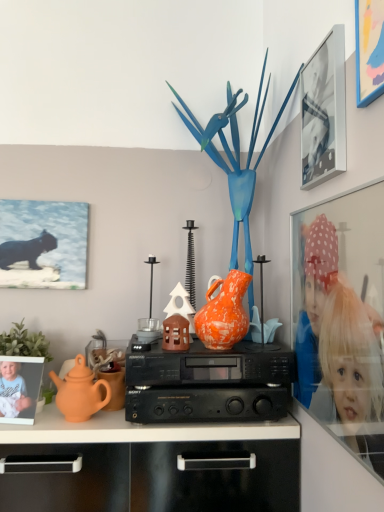
This screenshot has width=384, height=512. Describe the element at coordinates (324, 111) in the screenshot. I see `metallic silver picture frame at upper right, which is counted as the second picture frame, starting from the back` at that location.

What do you see at coordinates (235, 156) in the screenshot? I see `blue glossy bird at center` at bounding box center [235, 156].

How much space does matte black cat at upper left, which ranks as the 4th picture frame in right-to-left order, occupy vertically?

The height of matte black cat at upper left, which ranks as the 4th picture frame in right-to-left order, is 12.28 inches.

Find the location of a particular element. The width and height of the screenshot is (384, 512). green matte plant at left is located at coordinates (24, 343).

Measure the distance between point [239,315] and camera.

The depth of point [239,315] is 3.76 feet.

Where is `black plastic stereo at center`? black plastic stereo at center is located at coordinates (208, 383).

Is metallic silver picture frame at upper right, which is counted as the third picture frame, starting from the right, oriented away from black plastic stereo at center?

No, metallic silver picture frame at upper right, which is counted as the third picture frame, starting from the right,'s orientation is not away from black plastic stereo at center.

Is metallic silver picture frame at upper right, marked as the second picture frame in a left-to-right arrangement, directly adjacent to black plastic stereo at center?

There is a gap between metallic silver picture frame at upper right, marked as the second picture frame in a left-to-right arrangement, and black plastic stereo at center.

Based on the photo, does metallic silver picture frame at upper right, which is counted as the second picture frame, starting from the back, have a lesser height compared to black plastic stereo at center?

No, metallic silver picture frame at upper right, which is counted as the second picture frame, starting from the back, is not shorter than black plastic stereo at center.

From the image's perspective, which one is positioned lower, black plastic stereo at center or orange speckled vase at center?

black plastic stereo at center appears lower in the image.

Would you say black plastic stereo at center is inside or outside orange speckled vase at center?

black plastic stereo at center cannot be found inside orange speckled vase at center.

Is black plastic stereo at center to the left or to the right of orange speckled vase at center in the image?

Clearly, black plastic stereo at center is on the left of orange speckled vase at center in the image.

Does black plastic stereo at center have a greater width compared to orange speckled vase at center?

Correct, the width of black plastic stereo at center exceeds that of orange speckled vase at center.

Who is more distant, orange speckled vase at center or blue matte picture frame at upper right, the 4th picture frame from the back?

orange speckled vase at center.

Is orange speckled vase at center not close to blue matte picture frame at upper right, the 1th picture frame positioned from the right?

No.

In the image, is orange speckled vase at center on the left side or the right side of blue matte picture frame at upper right, which is the 1th picture frame in front-to-back order?

Based on their positions, orange speckled vase at center is located to the left of blue matte picture frame at upper right, which is the 1th picture frame in front-to-back order.

Find the location of a particular element. vase behind the blue matte picture frame at upper right, the 4th picture frame in the left-to-right sequence is located at coordinates (224, 313).

Is glass photo frame at right, which ranks as the 2th picture frame in front-to-back order, not within metallic silver picture frame at upper right, which ranks as the third picture frame in front-to-back order?

Yes.

From the image's perspective, is glass photo frame at right, which is the 3th picture frame from left to right, above or below metallic silver picture frame at upper right, which is counted as the third picture frame, starting from the right?

Based on their image positions, glass photo frame at right, which is the 3th picture frame from left to right, is located beneath metallic silver picture frame at upper right, which is counted as the third picture frame, starting from the right.

Is glass photo frame at right, marked as the 3th picture frame in a back-to-front arrangement, aimed at metallic silver picture frame at upper right, which is counted as the second picture frame, starting from the back?

No, glass photo frame at right, marked as the 3th picture frame in a back-to-front arrangement, is not aimed at metallic silver picture frame at upper right, which is counted as the second picture frame, starting from the back.

Would you say glass photo frame at right, marked as the 3th picture frame in a back-to-front arrangement, is a long distance from metallic silver picture frame at upper right, which ranks as the third picture frame in front-to-back order?

glass photo frame at right, marked as the 3th picture frame in a back-to-front arrangement, is actually quite close to metallic silver picture frame at upper right, which ranks as the third picture frame in front-to-back order.

From the picture: From a real-world perspective, is glass photo frame at right, which ranks as the 2th picture frame in front-to-back order, below blue glossy bird at center?

Yes, from a real-world perspective, glass photo frame at right, which ranks as the 2th picture frame in front-to-back order, is below blue glossy bird at center.

In the scene shown: Does glass photo frame at right, marked as the 3th picture frame in a back-to-front arrangement, have a lesser height compared to blue glossy bird at center?

Indeed, glass photo frame at right, marked as the 3th picture frame in a back-to-front arrangement, has a lesser height compared to blue glossy bird at center.

Would you say glass photo frame at right, which is the 3th picture frame from left to right, is outside blue glossy bird at center?

That's correct, glass photo frame at right, which is the 3th picture frame from left to right, is outside of blue glossy bird at center.

Considering the positions of objects glass photo frame at right, which ranks as the 2th picture frame in front-to-back order, and blue glossy bird at center in the image provided, who is more to the right, glass photo frame at right, which ranks as the 2th picture frame in front-to-back order, or blue glossy bird at center?

From the viewer's perspective, glass photo frame at right, which ranks as the 2th picture frame in front-to-back order, appears more on the right side.

In terms of size, does matte orange teapot at left appear bigger or smaller than glass photo frame at right, which ranks as the 2th picture frame in front-to-back order?

In the image, matte orange teapot at left appears to be smaller than glass photo frame at right, which ranks as the 2th picture frame in front-to-back order.

Considering the sizes of matte orange teapot at left and glass photo frame at right, which is the 3th picture frame from left to right, in the image, is matte orange teapot at left taller or shorter than glass photo frame at right, which is the 3th picture frame from left to right,?

In the image, matte orange teapot at left appears to be shorter than glass photo frame at right, which is the 3th picture frame from left to right.

Is matte orange teapot at left facing away from glass photo frame at right, which ranks as the 2th picture frame in front-to-back order?

No, matte orange teapot at left is not facing away from glass photo frame at right, which ranks as the 2th picture frame in front-to-back order.

Can black plastic stereo at center be found inside matte black cat at upper left, which ranks as the 4th picture frame in right-to-left order?

No, matte black cat at upper left, which ranks as the 4th picture frame in right-to-left order, does not contain black plastic stereo at center.

Considering the relative sizes of matte black cat at upper left, which ranks as the 4th picture frame in right-to-left order, and black plastic stereo at center in the image provided, is matte black cat at upper left, which ranks as the 4th picture frame in right-to-left order, taller than black plastic stereo at center?

Indeed, matte black cat at upper left, which ranks as the 4th picture frame in right-to-left order, has a greater height compared to black plastic stereo at center.

Based on the photo, is matte black cat at upper left, the fourth picture frame viewed from the front, looking in the opposite direction of black plastic stereo at center?

No, matte black cat at upper left, the fourth picture frame viewed from the front, is not facing away from black plastic stereo at center.

Locate an element on the screen. Image resolution: width=384 pixels, height=512 pixels. stereo on the left of metallic silver picture frame at upper right, which is counted as the second picture frame, starting from the back is located at coordinates (208, 383).

You are a GUI agent. You are given a task and a screenshot of the screen. Output one action in this format:
    pyautogui.click(x=<x>, y=<y>)
    Task: Click on the stereo below the orange speckled vase at center (from a real-world perspective)
    This screenshot has height=512, width=384.
    Given the screenshot: What is the action you would take?
    pyautogui.click(x=208, y=383)

Which object lies nearer to the anchor point orange speckled vase at center, green matte plant at left or glass photo frame at right, which ranks as the 2th picture frame in front-to-back order?

glass photo frame at right, which ranks as the 2th picture frame in front-to-back order, lies closer to orange speckled vase at center than the other object.

From the image, which object appears to be farther from blue matte picture frame at upper right, which is the 1th picture frame in front-to-back order, matte orange teapot at left or blue glossy bird at center?

matte orange teapot at left is further to blue matte picture frame at upper right, which is the 1th picture frame in front-to-back order.

Estimate the real-world distances between objects in this image. Which object is closer to matte orange teapot at left, matte black cat at upper left, which ranks as the 4th picture frame in right-to-left order, or blue glossy bird at center?

Among the two, matte black cat at upper left, which ranks as the 4th picture frame in right-to-left order, is located nearer to matte orange teapot at left.

Considering their positions, is blue matte picture frame at upper right, which is the 1th picture frame in front-to-back order, positioned further to green matte plant at left than orange speckled vase at center?

blue matte picture frame at upper right, which is the 1th picture frame in front-to-back order, is positioned further to the anchor green matte plant at left.

Which object lies nearer to the anchor point glass photo frame at right, marked as the second picture frame in a right-to-left arrangement, metallic silver picture frame at upper right, which is counted as the second picture frame, starting from the back, or green matte plant at left?

Among the two, metallic silver picture frame at upper right, which is counted as the second picture frame, starting from the back, is located nearer to glass photo frame at right, marked as the second picture frame in a right-to-left arrangement.

Estimate the real-world distances between objects in this image. Which object is further from matte orange teapot at left, matte black cat at upper left, acting as the 1th picture frame starting from the left, or metallic silver picture frame at upper right, which ranks as the third picture frame in front-to-back order?

metallic silver picture frame at upper right, which ranks as the third picture frame in front-to-back order.

Which object lies nearer to the anchor point glass photo frame at right, which ranks as the 2th picture frame in front-to-back order, orange speckled vase at center or metallic silver picture frame at upper right, which is counted as the third picture frame, starting from the right?

metallic silver picture frame at upper right, which is counted as the third picture frame, starting from the right.

Which object lies nearer to the anchor point glass photo frame at right, marked as the 3th picture frame in a back-to-front arrangement, blue glossy bird at center or black plastic stereo at center?

black plastic stereo at center is closer to glass photo frame at right, marked as the 3th picture frame in a back-to-front arrangement.

Locate an element on the screen. teapot situated between matte black cat at upper left, the fourth picture frame viewed from the front, and black plastic stereo at center from left to right is located at coordinates (80, 392).

You are a GUI agent. You are given a task and a screenshot of the screen. Output one action in this format:
    pyautogui.click(x=<x>, y=<y>)
    Task: Click on the stereo between blue glossy bird at center and matte orange teapot at left in the vertical direction
    The height and width of the screenshot is (512, 384).
    Given the screenshot: What is the action you would take?
    pyautogui.click(x=208, y=383)

Identify the location of toy between matte black cat at upper left, acting as the 1th picture frame starting from the left, and blue matte picture frame at upper right, which is the 1th picture frame in front-to-back order, in the horizontal direction. (235, 156).

The image size is (384, 512). I want to click on vase between green matte plant at left and glass photo frame at right, which ranks as the 2th picture frame in front-to-back order, in the horizontal direction, so 224,313.